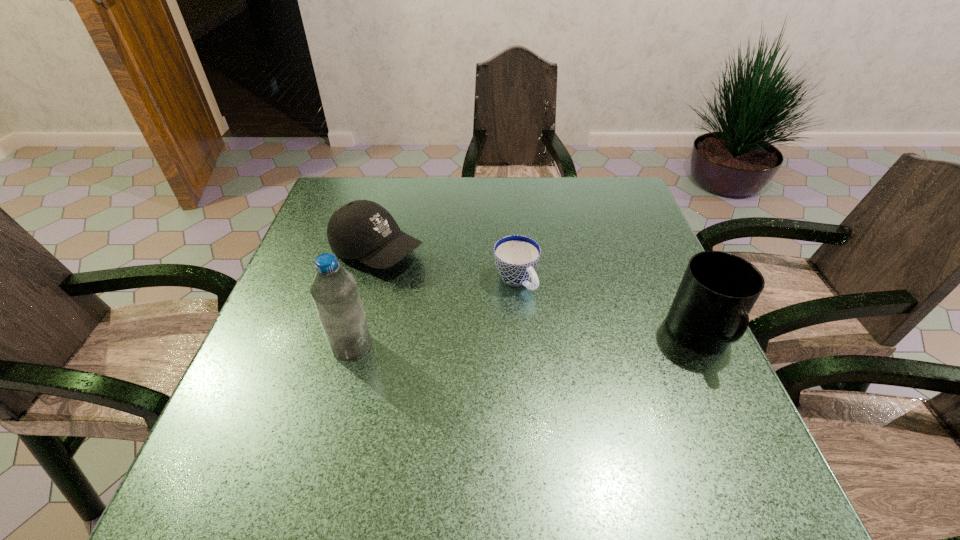
This screenshot has width=960, height=540. I want to click on vacant space situated 0.130m on the front-facing side of the baseball cap, so click(457, 287).

Identify the location of free space located 0.250m on the side of the cup with the handle. The width and height of the screenshot is (960, 540). [x=601, y=377].

You are a GUI agent. You are given a task and a screenshot of the screen. Output one action in this format:
    pyautogui.click(x=<x>, y=<y>)
    Task: Click on the vacant region located 0.100m on the side of the cup with the handle
    The width and height of the screenshot is (960, 540).
    Given the screenshot: What is the action you would take?
    pyautogui.click(x=555, y=326)

The image size is (960, 540). I want to click on vacant space located on the side of the cup with the handle, so click(541, 311).

At what (x,y) coordinates should I click in order to perform the action: click on water bottle at the left edge. Please return your answer as a coordinate pair (x, y). The height and width of the screenshot is (540, 960). Looking at the image, I should click on (334, 290).

Find the location of `baseball cap that is at the left edge`. baseball cap that is at the left edge is located at coordinates (364, 230).

Identify the location of object that is at the right edge. The height and width of the screenshot is (540, 960). (710, 310).

Where is `blank area at the far edge`? The height and width of the screenshot is (540, 960). blank area at the far edge is located at coordinates (395, 213).

Find the location of a particular element. The height and width of the screenshot is (540, 960). free location at the near edge is located at coordinates (434, 396).

You are a GUI agent. You are given a task and a screenshot of the screen. Output one action in this format:
    pyautogui.click(x=<x>, y=<y>)
    Task: Click on the vacant space at the left edge of the desktop
    The image size is (960, 540).
    Given the screenshot: What is the action you would take?
    pyautogui.click(x=300, y=383)